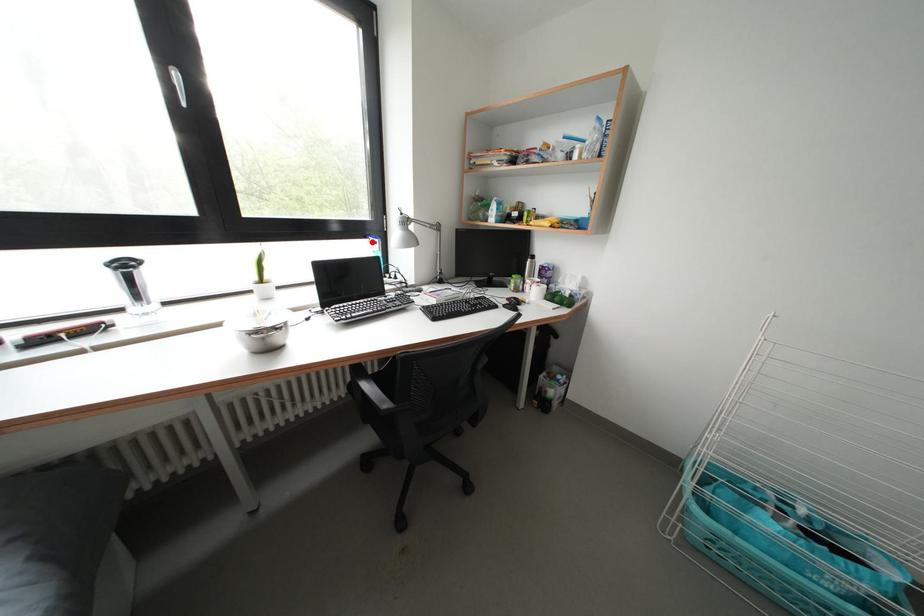
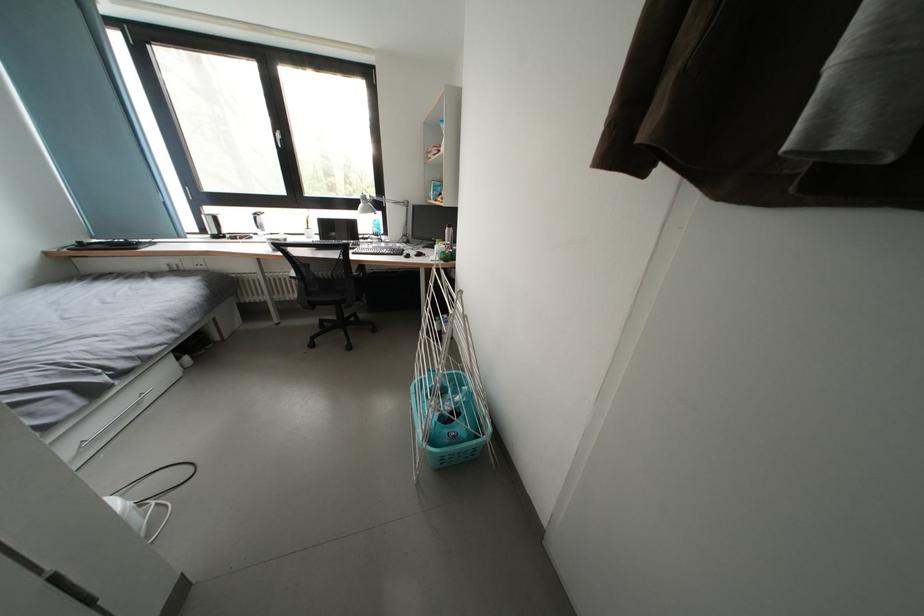
Find the pixel in the second image that matches the highlighted location in the first image.

(377, 215)